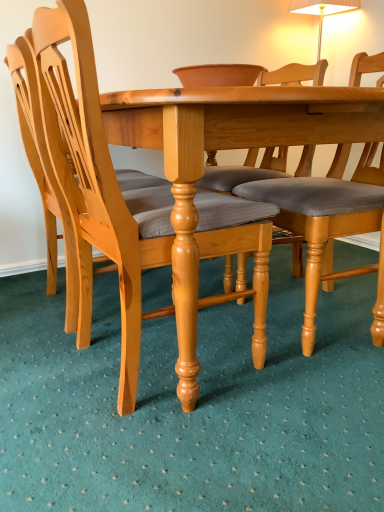
Locate an element on the screen. Image resolution: width=384 pixels, height=512 pixels. vacant space in front of light brown wood chair at left, placed as the second chair when sorted from right to left is located at coordinates (179, 456).